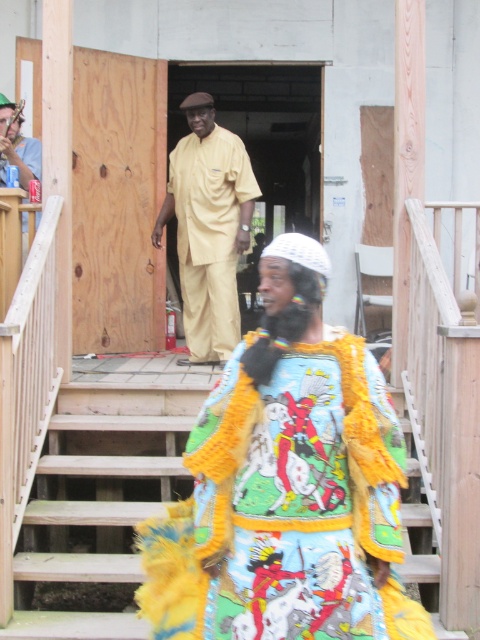
You are a construction worker standing at the bottom of the wooden stairs at lower center. You need to deliver a tool to the beige matte uniform at center. Which direction should you move to reach them?

The wooden stairs at lower center is positioned on the left side of beige matte uniform at center, so you should move to the right to reach them.

You are standing at the base of the stairs and want to hand a tool to the person wearing the multicolored fabric costume at center. The tool you have is 3 meters long. Can you reach them without moving closer?

The multicolored fabric costume at center and viewer are 2.98 meters apart. Since the tool is 3 meters long, you can reach them by extending the tool fully.

You are standing at the point marked by the coordinates point (287, 486). Looking around, you see a multicolored fabric costume at center. What direction is the multicolored fabric costume at center relative to your current position?

You are already at the position marked by point (287, 486), which is where the multicolored fabric costume at center is located.